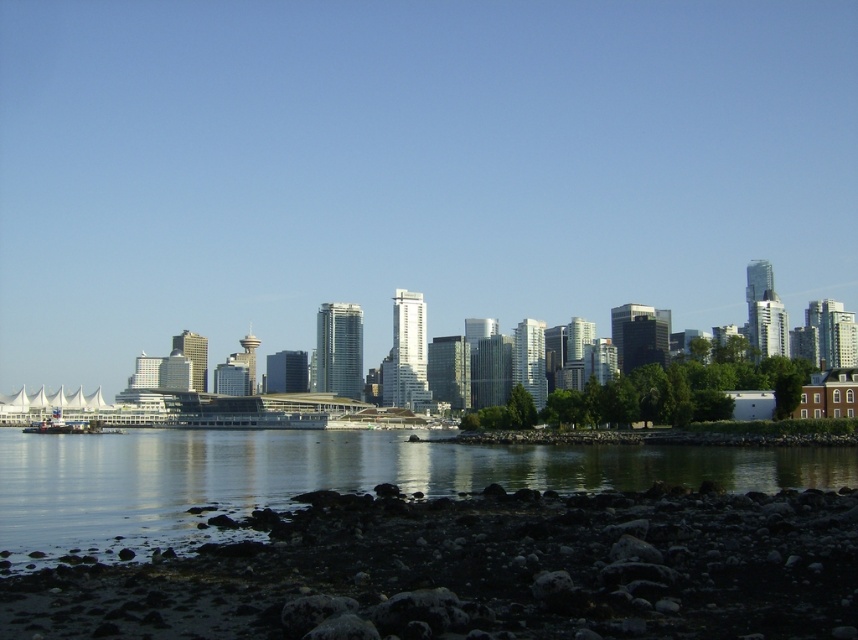
Question: Does dark gray rocky shore at lower left have a greater width compared to smooth dark water at lower center?

Choices:
 (A) yes
 (B) no

Answer: (B)

Question: Is dark gray rocky shore at lower left above smooth dark water at lower center?

Choices:
 (A) no
 (B) yes

Answer: (B)

Question: Among these points, which one is farthest from the camera?

Choices:
 (A) (231, 563)
 (B) (835, 448)

Answer: (B)

Question: Among these points, which one is farthest from the camera?

Choices:
 (A) (16, 524)
 (B) (819, 520)

Answer: (A)

Question: Does dark gray rocky shore at lower left appear on the left side of smooth dark water at lower center?

Choices:
 (A) no
 (B) yes

Answer: (A)

Question: Which object appears closest to the camera in this image?

Choices:
 (A) dark gray rocky shore at lower left
 (B) smooth dark water at lower center

Answer: (A)